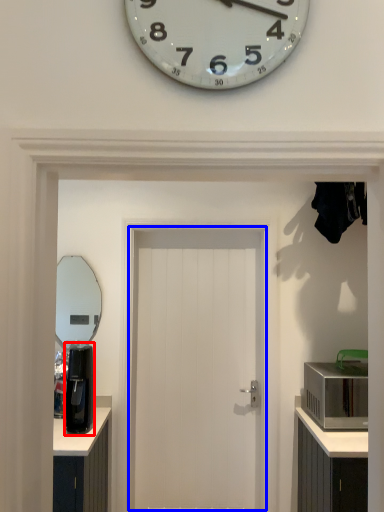
Question: Which point is closer to the camera, coffee machine (highlighted by a red box) or door (highlighted by a blue box)?

Choices:
 (A) coffee machine
 (B) door

Answer: (A)